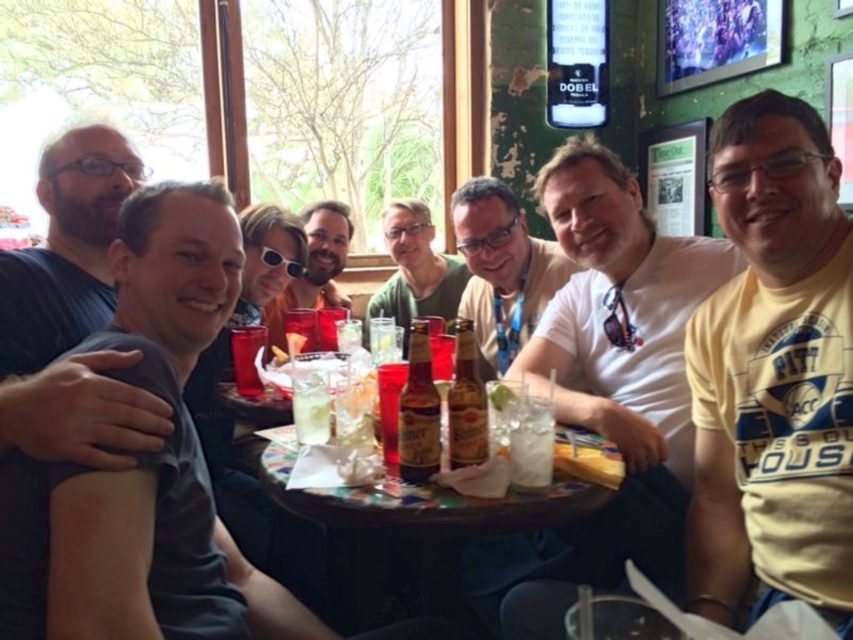
Question: Among these points, which one is nearest to the camera?

Choices:
 (A) click(550, 284)
 (B) click(119, 224)

Answer: (B)

Question: Which of these objects is positioned closest to the white matte shirt at center?

Choices:
 (A) clear glass at table center
 (B) translucent glass beer at center
 (C) translucent plastic cup at center
 (D) white cotton shirt at center

Answer: (D)

Question: Does dark gray t-shirt at left appear on the right side of clear glass at table center?

Choices:
 (A) no
 (B) yes

Answer: (A)

Question: Does matte black sunglasses at center have a greater width compared to brown glass beer bottle at center?

Choices:
 (A) no
 (B) yes

Answer: (B)

Question: Which point is closer to the camera?

Choices:
 (A) (379, 371)
 (B) (254, 332)
 (C) (291, 266)

Answer: (A)

Question: Is brown glass bottle at center smaller than sunglasses at center?

Choices:
 (A) yes
 (B) no

Answer: (B)